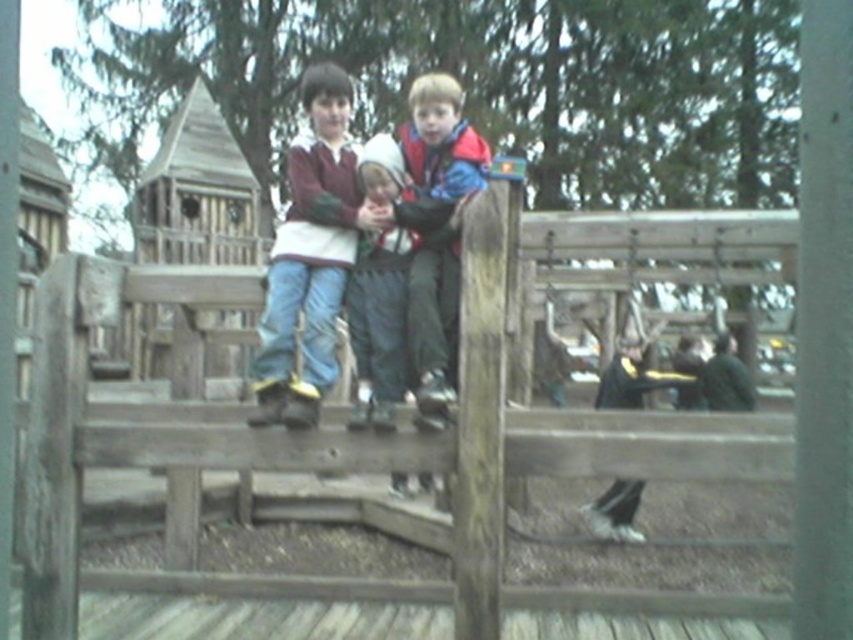
Question: Which of the following is the farthest from the observer?

Choices:
 (A) (300, 385)
 (B) (421, 304)
 (C) (550, 272)

Answer: (C)

Question: From the image, what is the correct spatial relationship of matte maroon sweater at center in relation to matte blue jacket at center?

Choices:
 (A) left
 (B) right

Answer: (A)

Question: Considering the relative positions of smooth gray pole at center and matte blue jacket at center in the image provided, where is smooth gray pole at center located with respect to matte blue jacket at center?

Choices:
 (A) left
 (B) right

Answer: (B)

Question: Which of the following is the closest to the observer?

Choices:
 (A) wooden at center
 (B) matte maroon sweater at center

Answer: (A)

Question: Does wooden at center appear under matte maroon sweater at center?

Choices:
 (A) no
 (B) yes

Answer: (B)

Question: Estimate the real-world distances between objects in this image. Which object is farther from the matte blue jacket at center?

Choices:
 (A) matte maroon sweater at center
 (B) smooth gray pole at center

Answer: (B)